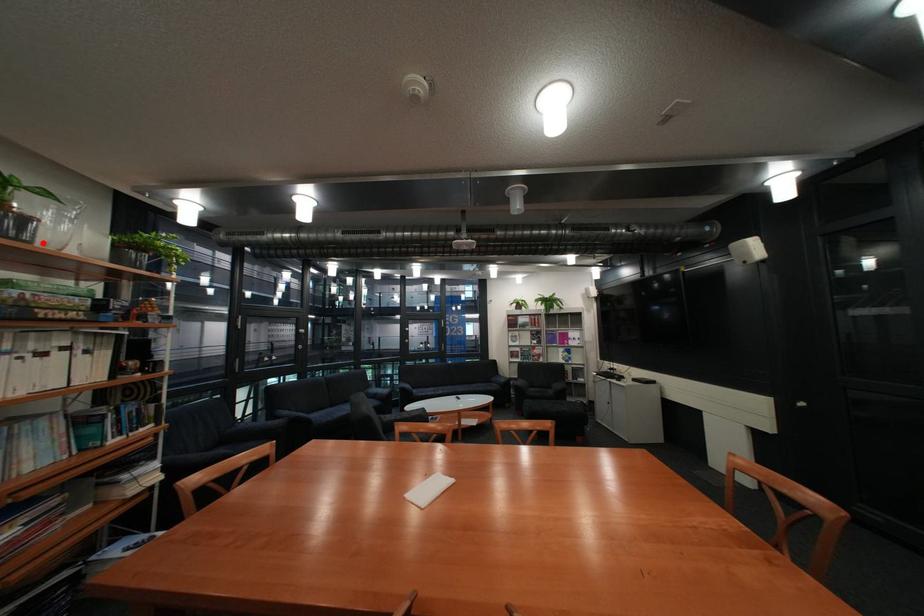
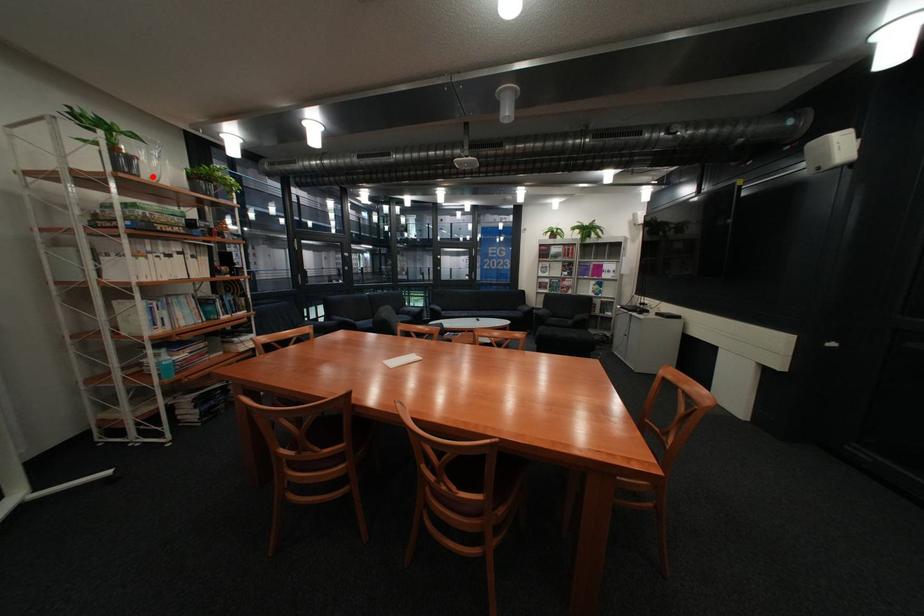
I am providing you with two images of the same scene from different viewpoints. A red point is marked on the first image and another point is marked on the second image. Is the marked point in image1 the same physical position as the marked point in image2?

Yes